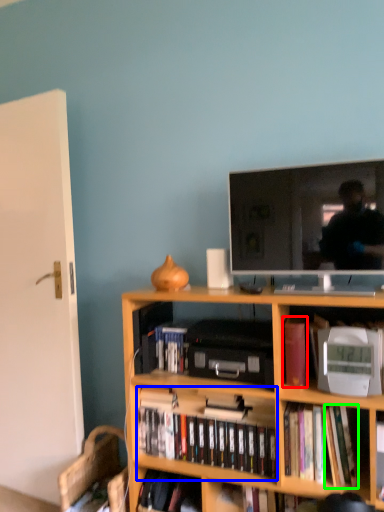
Question: Considering the real-world distances, which object is farthest from book (highlighted by a red box)? book (highlighted by a blue box) or paperback book (highlighted by a green box)?

Choices:
 (A) book
 (B) paperback book

Answer: (A)